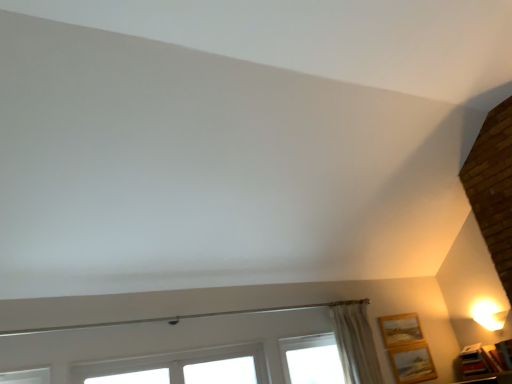
This screenshot has width=512, height=384. Describe the element at coordinates (412, 363) in the screenshot. I see `wooden picture frame at lower right, arranged as the 2th picture frame when viewed from the right` at that location.

How much space does wooden picture frame at lower right, arranged as the 2th picture frame when viewed from the right, occupy horizontally?

wooden picture frame at lower right, arranged as the 2th picture frame when viewed from the right, is 1.17 inches wide.

Locate an element on the screen. This screenshot has width=512, height=384. wooden picture frame at lower right, positioned as the third picture frame in right-to-left order is located at coordinates (400, 329).

The width and height of the screenshot is (512, 384). In order to click on white glossy table lamp at upper right in this screenshot , I will do `click(489, 315)`.

Looking at this image, in terms of height, does beige textured curtain at upper right look taller or shorter compared to wooden picture frame at lower right, which is counted as the first picture frame, starting from the right?

In the image, beige textured curtain at upper right appears to be taller than wooden picture frame at lower right, which is counted as the first picture frame, starting from the right.

Is beige textured curtain at upper right aimed at wooden picture frame at lower right, positioned as the third picture frame in left-to-right order?

No, beige textured curtain at upper right is not turned towards wooden picture frame at lower right, positioned as the third picture frame in left-to-right order.

Between point (367, 354) and point (510, 350), which one is positioned behind?

The point (367, 354) is behind.

From a real-world perspective, which is physically above, beige textured curtain at upper right or wooden picture frame at lower right, which is counted as the first picture frame, starting from the right?

From a 3D spatial view, beige textured curtain at upper right is above.

Between wooden picture frame at lower right, arranged as the 2th picture frame when viewed from the right, and wooden picture frame at lower right, positioned as the third picture frame in right-to-left order, which one appears on the left side from the viewer's perspective?

Positioned to the left is wooden picture frame at lower right, positioned as the third picture frame in right-to-left order.

Is wooden picture frame at lower right, arranged as the 2th picture frame when viewed from the right, positioned before wooden picture frame at lower right, the first picture frame from the left?

Yes, it is.

Is wooden picture frame at lower right, arranged as the 2th picture frame when viewed from the right, located outside wooden picture frame at lower right, the first picture frame from the left?

Absolutely, wooden picture frame at lower right, arranged as the 2th picture frame when viewed from the right, is external to wooden picture frame at lower right, the first picture frame from the left.

Who is smaller, wooden picture frame at lower right, the second picture frame when ordered from left to right, or wooden picture frame at lower right, the first picture frame from the left?

wooden picture frame at lower right, the second picture frame when ordered from left to right.

From a real-world perspective, is white plastic window at lower center on wooden picture frame at lower right, the first picture frame from the left?

No, from a real-world perspective, white plastic window at lower center is not over wooden picture frame at lower right, the first picture frame from the left

Considering the relative sizes of white plastic window at lower center and wooden picture frame at lower right, the first picture frame from the left, in the image provided, is white plastic window at lower center smaller than wooden picture frame at lower right, the first picture frame from the left,?

No, white plastic window at lower center is not smaller than wooden picture frame at lower right, the first picture frame from the left.

Considering the positions of objects white plastic window at lower center and wooden picture frame at lower right, positioned as the third picture frame in right-to-left order, in the image provided, who is more to the left, white plastic window at lower center or wooden picture frame at lower right, positioned as the third picture frame in right-to-left order,?

white plastic window at lower center is more to the left.

Is the position of wooden picture frame at lower right, which is counted as the first picture frame, starting from the right, less distant than that of wooden picture frame at lower right, positioned as the third picture frame in right-to-left order?

Yes, wooden picture frame at lower right, which is counted as the first picture frame, starting from the right, is closer to the viewer.

Which object is positioned more to the right, wooden picture frame at lower right, which is counted as the first picture frame, starting from the right, or wooden picture frame at lower right, the first picture frame from the left?

From the viewer's perspective, wooden picture frame at lower right, which is counted as the first picture frame, starting from the right, appears more on the right side.

Is wooden picture frame at lower right, which is counted as the first picture frame, starting from the right, not close to wooden picture frame at lower right, positioned as the third picture frame in right-to-left order?

No, wooden picture frame at lower right, which is counted as the first picture frame, starting from the right, is not far away from wooden picture frame at lower right, positioned as the third picture frame in right-to-left order.

Between wooden picture frame at lower right, positioned as the third picture frame in left-to-right order, and wooden picture frame at lower right, positioned as the third picture frame in right-to-left order, which one has more height?

With more height is wooden picture frame at lower right, positioned as the third picture frame in right-to-left order.

This screenshot has width=512, height=384. I want to click on table lamp above the wooden picture frame at lower right, positioned as the third picture frame in left-to-right order (from a real-world perspective), so click(x=489, y=315).

Which object is further away from the camera, white glossy table lamp at upper right or wooden picture frame at lower right, positioned as the third picture frame in left-to-right order?

white glossy table lamp at upper right is further away from the camera.

From the image's perspective, is white glossy table lamp at upper right under wooden picture frame at lower right, which is counted as the first picture frame, starting from the right?

No, from the image's perspective, white glossy table lamp at upper right is not below wooden picture frame at lower right, which is counted as the first picture frame, starting from the right.

Is white glossy table lamp at upper right oriented towards wooden picture frame at lower right, which is counted as the first picture frame, starting from the right?

No.

Is white glossy table lamp at upper right far away from white plastic window at lower center?

white glossy table lamp at upper right is far away from white plastic window at lower center.

Considering the sizes of white glossy table lamp at upper right and white plastic window at lower center in the image, is white glossy table lamp at upper right wider or thinner than white plastic window at lower center?

Clearly, white glossy table lamp at upper right has more width compared to white plastic window at lower center.

Is white glossy table lamp at upper right taller than white plastic window at lower center?

Incorrect, the height of white glossy table lamp at upper right is not larger of that of white plastic window at lower center.

From a real-world perspective, is beige textured curtain at upper right positioned under wooden picture frame at lower right, positioned as the third picture frame in right-to-left order, based on gravity?

Yes, from a real-world perspective, beige textured curtain at upper right is beneath wooden picture frame at lower right, positioned as the third picture frame in right-to-left order.

Is point (380, 373) positioned in front of point (396, 333)?

Yes.

Where is `curtain on the left of wooden picture frame at lower right, positioned as the third picture frame in right-to-left order`? The width and height of the screenshot is (512, 384). curtain on the left of wooden picture frame at lower right, positioned as the third picture frame in right-to-left order is located at coordinates (355, 343).

Is beige textured curtain at upper right oriented away from wooden picture frame at lower right, the first picture frame from the left?

No, wooden picture frame at lower right, the first picture frame from the left, is not at the back of beige textured curtain at upper right.

The image size is (512, 384). I want to click on the 3rd picture frame to the right when counting from the beige textured curtain at upper right, so click(505, 352).

You are a GUI agent. You are given a task and a screenshot of the screen. Output one action in this format:
    pyautogui.click(x=<x>, y=<y>)
    Task: Click on the picture frame above the wooden picture frame at lower right, arranged as the 2th picture frame when viewed from the right (from a real-world perspective)
    The width and height of the screenshot is (512, 384).
    Given the screenshot: What is the action you would take?
    pyautogui.click(x=400, y=329)

When comparing their distances from wooden picture frame at lower right, the second picture frame when ordered from left to right, does wooden picture frame at lower right, positioned as the third picture frame in right-to-left order, or white glossy table lamp at upper right seem further?

Based on the image, white glossy table lamp at upper right appears to be further to wooden picture frame at lower right, the second picture frame when ordered from left to right.

Which object lies nearer to the anchor point white glossy table lamp at upper right, wooden picture frame at lower right, the first picture frame from the left, or wooden picture frame at lower right, arranged as the 2th picture frame when viewed from the right?

wooden picture frame at lower right, the first picture frame from the left, is closer to white glossy table lamp at upper right.

Looking at the image, which one is located further to white glossy table lamp at upper right, beige textured curtain at upper right or white plastic window at lower center?

white plastic window at lower center is further to white glossy table lamp at upper right.

Based on their spatial positions, is beige textured curtain at upper right or wooden picture frame at lower right, which is counted as the first picture frame, starting from the right, further from white glossy table lamp at upper right?

Based on the image, beige textured curtain at upper right appears to be further to white glossy table lamp at upper right.

Based on their spatial positions, is wooden picture frame at lower right, the first picture frame from the left, or beige textured curtain at upper right further from wooden picture frame at lower right, which is counted as the first picture frame, starting from the right?

Among the two, beige textured curtain at upper right is located further to wooden picture frame at lower right, which is counted as the first picture frame, starting from the right.

Based on their spatial positions, is white plastic window at lower center or beige textured curtain at upper right further from wooden picture frame at lower right, the first picture frame from the left?

white plastic window at lower center is positioned further to the anchor wooden picture frame at lower right, the first picture frame from the left.

Which object lies nearer to the anchor point beige textured curtain at upper right, wooden picture frame at lower right, positioned as the third picture frame in right-to-left order, or white plastic window at lower center?

wooden picture frame at lower right, positioned as the third picture frame in right-to-left order.

Which object lies further to the anchor point white glossy table lamp at upper right, wooden picture frame at lower right, the first picture frame from the left, or wooden picture frame at lower right, positioned as the third picture frame in left-to-right order?

wooden picture frame at lower right, the first picture frame from the left, is positioned further to the anchor white glossy table lamp at upper right.

In order to click on curtain between white plastic window at lower center and wooden picture frame at lower right, the first picture frame from the left, in the horizontal direction in this screenshot , I will do `click(355, 343)`.

The image size is (512, 384). In order to click on table lamp between wooden picture frame at lower right, arranged as the 2th picture frame when viewed from the right, and wooden picture frame at lower right, positioned as the third picture frame in left-to-right order, from left to right in this screenshot , I will do `click(489, 315)`.

Locate an element on the screen. table lamp located between wooden picture frame at lower right, the first picture frame from the left, and wooden picture frame at lower right, positioned as the third picture frame in left-to-right order, in the left-right direction is located at coordinates (489, 315).

Where is `curtain situated between white plastic window at lower center and wooden picture frame at lower right, arranged as the 2th picture frame when viewed from the right, from left to right`? curtain situated between white plastic window at lower center and wooden picture frame at lower right, arranged as the 2th picture frame when viewed from the right, from left to right is located at coordinates (355, 343).